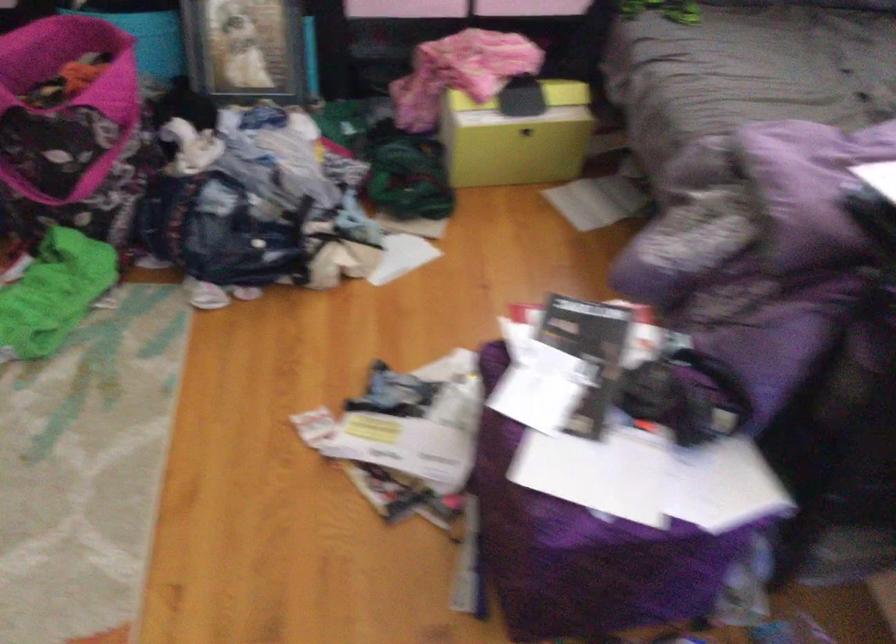
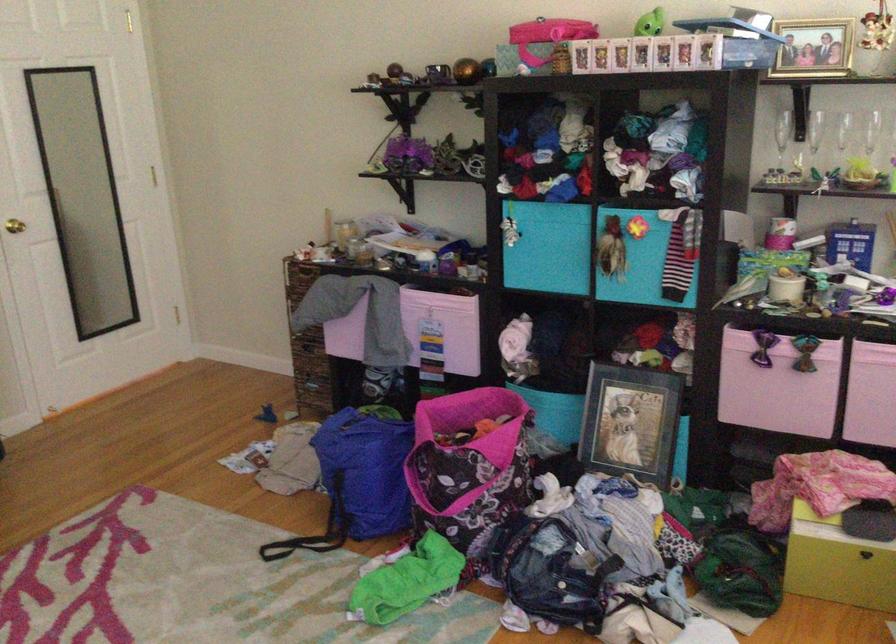
Where in the second image is the point corresponding to [497,144] from the first image?

(838, 563)